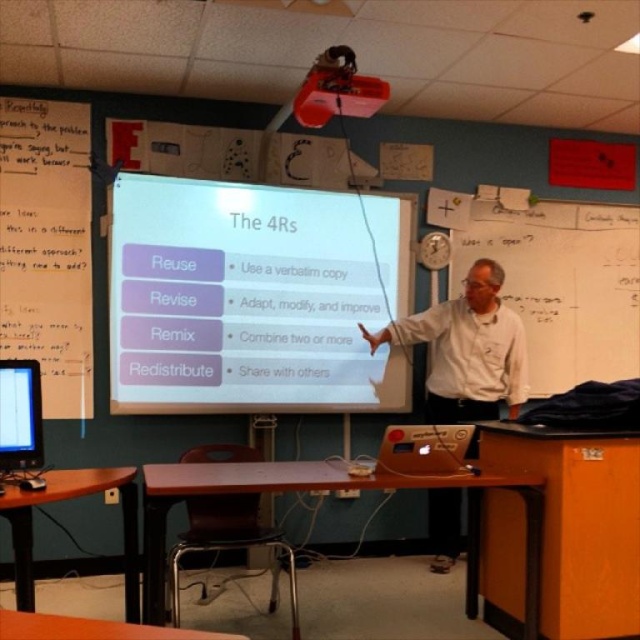
Does whiteboard at right appear on the left side of white shirt at center?

Incorrect, whiteboard at right is not on the left side of white shirt at center.

Does point (541, 294) come in front of point (372, 346)?

No, it is not.

Is point (506, 280) positioned behind point (440, 368)?

Yes.

Find the location of a particular element. The width and height of the screenshot is (640, 640). whiteboard at right is located at coordinates (561, 282).

Which of these two, white shirt at center or black glossy screen at lower left, stands shorter?

black glossy screen at lower left

Does white shirt at center have a greater width compared to black glossy screen at lower left?

Indeed, white shirt at center has a greater width compared to black glossy screen at lower left.

The width and height of the screenshot is (640, 640). What do you see at coordinates (467, 349) in the screenshot?
I see `white shirt at center` at bounding box center [467, 349].

Image resolution: width=640 pixels, height=640 pixels. In order to click on white shirt at center in this screenshot , I will do `click(467, 349)`.

Does point (352, 257) come farther from viewer compared to point (529, 346)?

No, it is not.

Is the position of white glossy projector screen at center less distant than that of whiteboard at right?

Yes, it is.

What do you see at coordinates (252, 298) in the screenshot?
I see `white glossy projector screen at center` at bounding box center [252, 298].

What are the coordinates of `white glossy projector screen at center` in the screenshot? It's located at (252, 298).